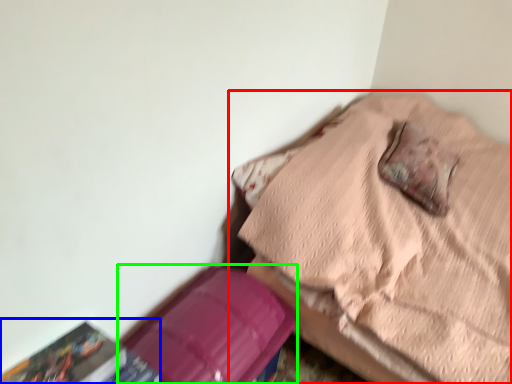
Question: Based on their relative distances, which object is nearer to furniture (highlighted by a red box)? Choose from paperback book (highlighted by a blue box) and cardboard box (highlighted by a green box).

Choices:
 (A) paperback book
 (B) cardboard box

Answer: (B)